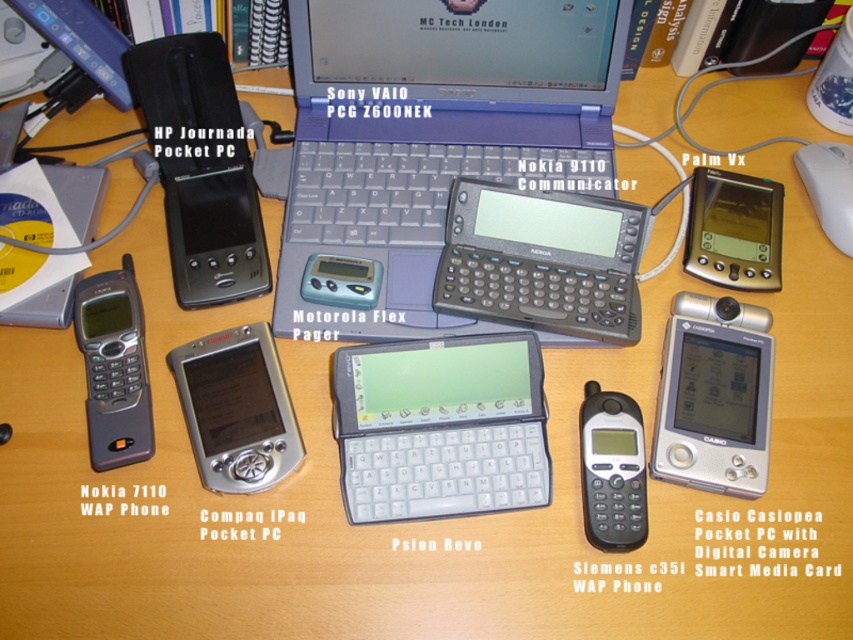
You are a delivery person who needs to place a new device between the silver metallic pocket pc at center and the Sony VAIO PCG Z600NEK laptop. The new device is 28 inches long. Will it fit between them?

The distance between the silver metallic pocket pc at center and the Sony VAIO PCG Z600NEK laptop is 27.23 inches. Since the new device is 28 inches long, it will not fit between them as it is slightly longer than the available space.

You are organizing the vintage electronics on the desk. You need to place a new label above the black plastic hp journda pocket pc at upper left. Will this new label interfere with the space occupied by the matte black nokia 7110 wap phone at lower left?

The black plastic hp journda pocket pc at upper left is above the matte black nokia 7110 wap phone at lower left. Placing a label above the hp journda pocket pc would be in a higher position, so it won